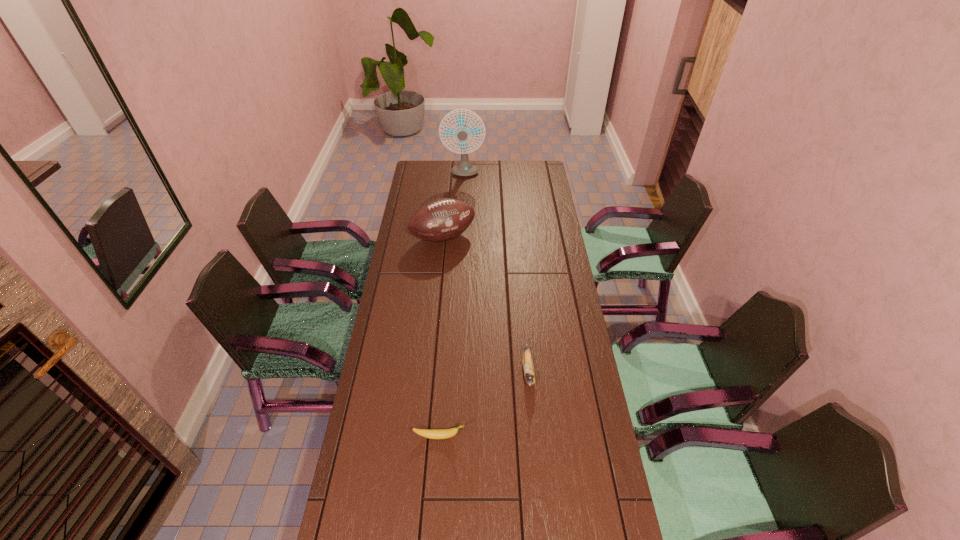
Locate an element on the screen. This screenshot has width=960, height=540. free space located 0.140m on the peel of the third tallest object is located at coordinates (534, 435).

Locate an element on the screen. The width and height of the screenshot is (960, 540). vacant space situated 0.050m at the stem of the nearer banana is located at coordinates (481, 436).

Locate an element on the screen. The height and width of the screenshot is (540, 960). object that is at the far edge is located at coordinates (464, 168).

Find the location of a particular element. The image size is (960, 540). object that is at the left edge is located at coordinates (443, 219).

Find the location of a particular element. This screenshot has height=540, width=960. vacant space at the far edge of the desktop is located at coordinates (513, 174).

Where is `vacant space at the left edge of the desktop`? vacant space at the left edge of the desktop is located at coordinates (370, 404).

At what (x,y) coordinates should I click in order to perform the action: click on free space at the right edge. Please return your answer as a coordinate pair (x, y). This screenshot has width=960, height=540. Looking at the image, I should click on (543, 345).

At what (x,y) coordinates should I click in order to perform the action: click on free region at the far right corner of the desktop. Please return your answer as a coordinate pair (x, y). This screenshot has height=540, width=960. Looking at the image, I should click on (524, 167).

At what (x,y) coordinates should I click in order to perform the action: click on empty space between the fan and the taller banana. Please return your answer as a coordinate pair (x, y). Looking at the image, I should click on (496, 273).

At what (x,y) coordinates should I click in order to perform the action: click on free area in between the third nearest object and the rightmost object. Please return your answer as a coordinate pair (x, y). Looking at the image, I should click on (486, 305).